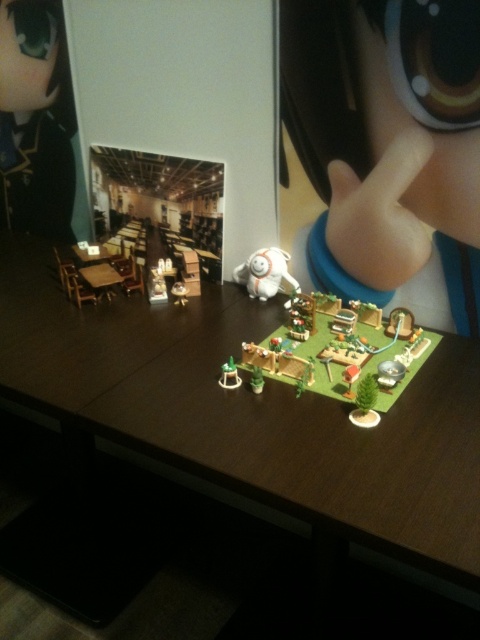
Question: Can you confirm if green matte miniature garden at center is positioned above green matte tree at center?

Choices:
 (A) no
 (B) yes

Answer: (B)

Question: Among these objects, which one is farthest from the camera?

Choices:
 (A) wooden table at center
 (B) green matte toy at center
 (C) white plush toy at center
 (D) green matte playset at center

Answer: (A)

Question: Which of these objects is positioned farthest from the green matte tree at center?

Choices:
 (A) white plush toy at center
 (B) metallic silver toy at center
 (C) green matte playset at center

Answer: (B)

Question: Can you confirm if wooden table at left is wider than green matte tree at center?

Choices:
 (A) no
 (B) yes

Answer: (B)

Question: Can you confirm if wooden table at left is positioned to the left of green matte toy at center?

Choices:
 (A) no
 (B) yes

Answer: (B)

Question: Among these points, which one is farthest from the camera?

Choices:
 (A) pyautogui.click(x=217, y=381)
 (B) pyautogui.click(x=88, y=256)

Answer: (B)